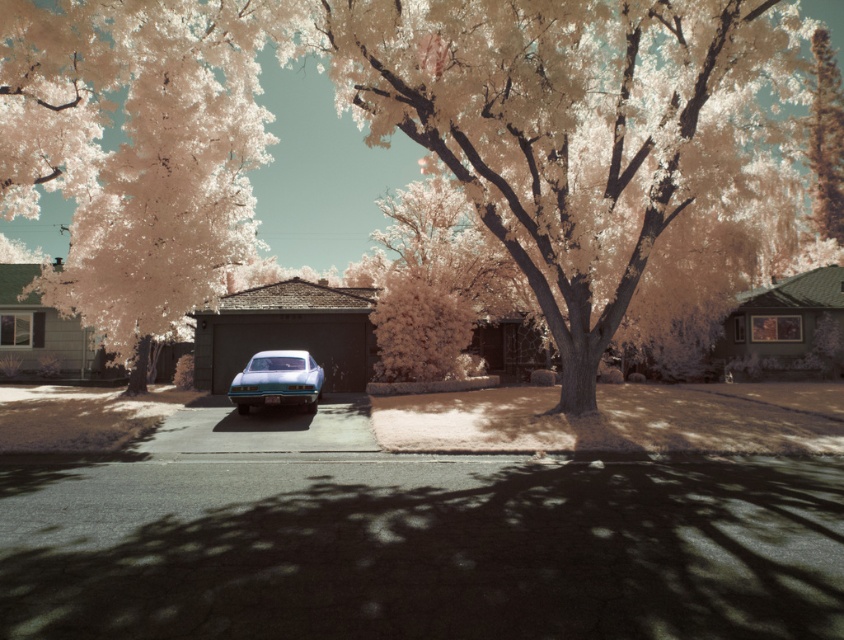
You are a photographer planning to take a picture of the dark brown wooden garage at right and the smooth bark tree at upper right. Based on their heights, which one should you focus on first if you want to capture both in a single frame without moving the camera?

The dark brown wooden garage at right has a lesser height compared to the smooth bark tree at upper right, so you should focus on the smooth bark tree at upper right first to ensure it fits within the frame.

You are a photographer planning to take a wide shot of the suburban scene. You need to ensure that both the dark brown wooden garage at right and the smooth bark tree at upper right are fully visible in the frame. Given their widths, which object might require you to adjust your camera angle to avoid cropping?

The smooth bark tree at upper right is wider than the dark brown wooden garage at right, so you might need to adjust your camera angle to ensure the smooth bark tree at upper right fits entirely within the frame.